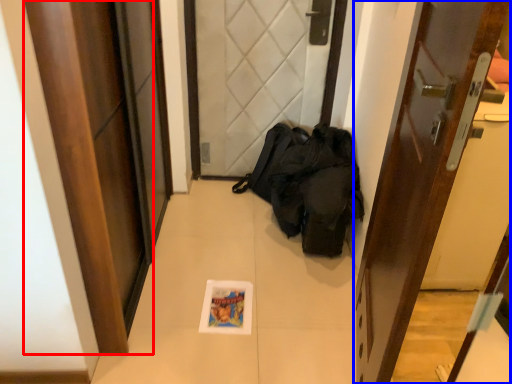
Question: Which object appears farthest to the camera in this image, door (highlighted by a red box) or door (highlighted by a blue box)?

Choices:
 (A) door
 (B) door

Answer: (A)